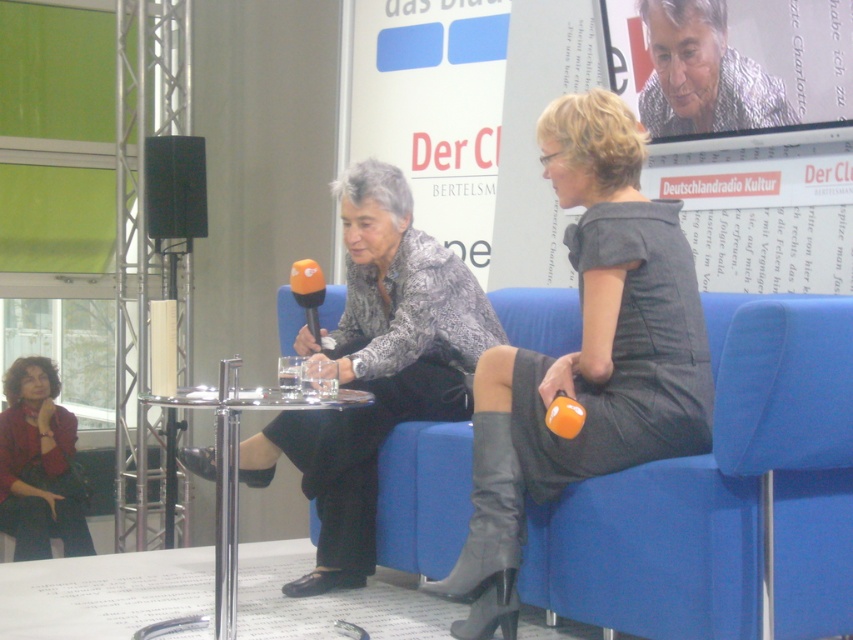
Can you confirm if matte red jacket at lower left is bigger than clear glass table at center?

Yes, matte red jacket at lower left is bigger than clear glass table at center.

Find the location of a particular element. This screenshot has height=640, width=853. matte red jacket at lower left is located at coordinates (38, 465).

Which of these two, matte gray dress at center or matte black speaker at upper left, stands shorter?

With less height is matte black speaker at upper left.

Does matte gray dress at center have a greater width compared to matte black speaker at upper left?

Correct, the width of matte gray dress at center exceeds that of matte black speaker at upper left.

In the scene shown: Who is more distant from viewer, (482, 422) or (161, 145)?

Point (161, 145)

Where is `matte gray dress at center`? matte gray dress at center is located at coordinates (585, 356).

Where is `blue fabric chair at center`? blue fabric chair at center is located at coordinates (724, 493).

In the scene shown: Which is more to the left, blue fabric chair at center or matte red jacket at lower left?

matte red jacket at lower left is more to the left.

Between point (584, 609) and point (28, 486), which one is positioned behind?

The point (28, 486) is more distant.

You are a GUI agent. You are given a task and a screenshot of the screen. Output one action in this format:
    pyautogui.click(x=<x>, y=<y>)
    Task: Click on the blue fabric chair at center
    The image size is (853, 640).
    Given the screenshot: What is the action you would take?
    pyautogui.click(x=724, y=493)